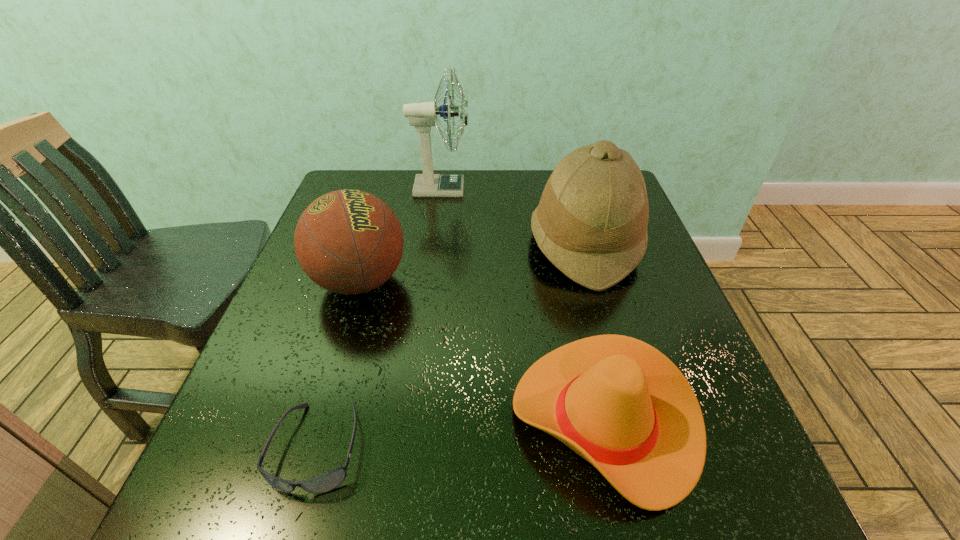
I want to click on vacant area between the fourth tallest object and the basketball, so click(483, 350).

This screenshot has height=540, width=960. Find the location of `vacant space that is in between the second shortest object and the third shortest object`. vacant space that is in between the second shortest object and the third shortest object is located at coordinates (483, 350).

In order to click on vacant area between the fan and the cowboy hat in this screenshot , I will do `click(523, 303)`.

Find the location of `free space between the hat and the fan`. free space between the hat and the fan is located at coordinates (513, 216).

Locate an element on the screen. The image size is (960, 540). empty location between the sunglasses and the fourth tallest object is located at coordinates (461, 433).

I want to click on vacant point located between the fan and the hat, so click(513, 216).

You are a GUI agent. You are given a task and a screenshot of the screen. Output one action in this format:
    pyautogui.click(x=<x>, y=<y>)
    Task: Click on the free space between the sunglasses and the basketball
    
    Given the screenshot: What is the action you would take?
    coord(339,364)

Where is `object that is the second closest to the sunglasses`? The height and width of the screenshot is (540, 960). object that is the second closest to the sunglasses is located at coordinates (619, 403).

Identify the location of the fourth closest object relative to the tallest object. The width and height of the screenshot is (960, 540). tap(326, 482).

This screenshot has height=540, width=960. I want to click on vacant area that satisfies the following two spatial constraints: 1. on the front-facing side of the cowboy hat; 2. on the right side of the tallest object, so click(x=412, y=419).